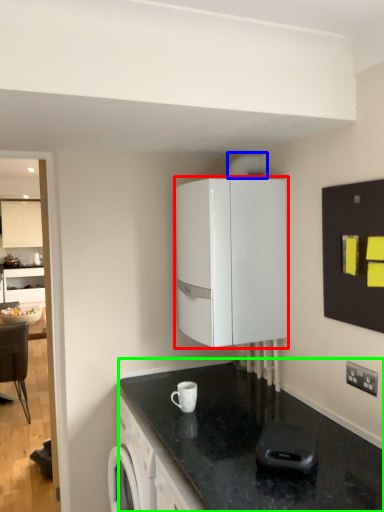
Question: Based on their relative distances, which object is nearer to cabinetry (highlighted by a red box)? Choose from appliance (highlighted by a blue box) and countertop (highlighted by a green box).

Choices:
 (A) appliance
 (B) countertop

Answer: (A)